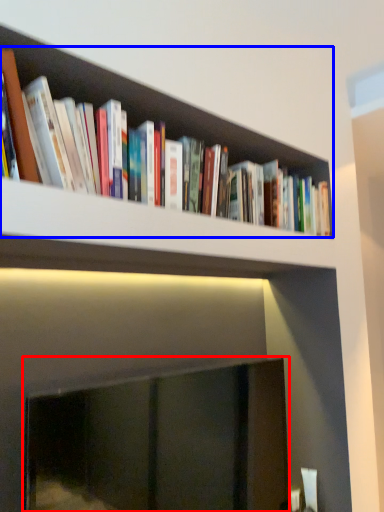
Question: Which object is further to the camera taking this photo, fireplace (highlighted by a red box) or book (highlighted by a blue box)?

Choices:
 (A) fireplace
 (B) book

Answer: (B)